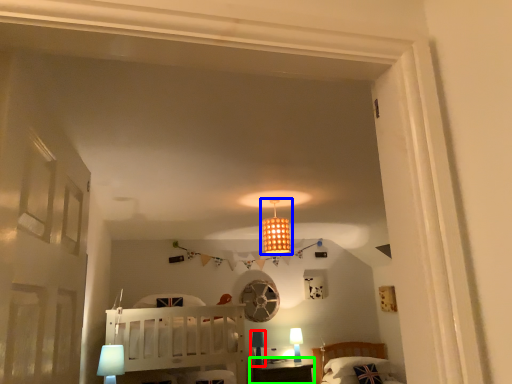
Question: Estimate the real-world distances between objects in this image. Which object is closer to table lamp (highlighted by a red box), lamp (highlighted by a blue box) or table (highlighted by a green box)?

Choices:
 (A) lamp
 (B) table

Answer: (B)